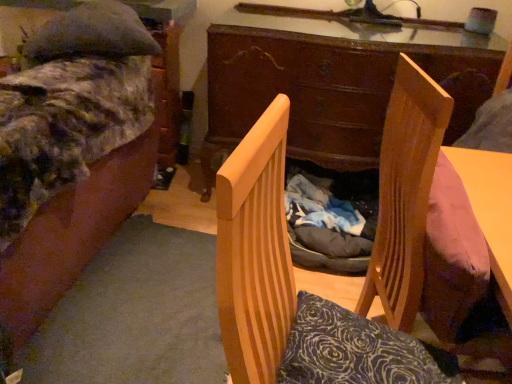
Question: In the image, is wooden chair at center on the left side or the right side of velvet-like fabric bed at left?

Choices:
 (A) right
 (B) left

Answer: (A)

Question: In the image, is wooden chair at center positioned in front of or behind velvet-like fabric bed at left?

Choices:
 (A) front
 (B) behind

Answer: (A)

Question: Based on their relative distances, which object is farther from the wooden chair at center?

Choices:
 (A) velvet-like fabric bed at left
 (B) wooden desk at center

Answer: (B)

Question: Based on their relative distances, which object is farther from the velvet-like fabric bed at left?

Choices:
 (A) wooden desk at center
 (B) wooden chair at center

Answer: (B)